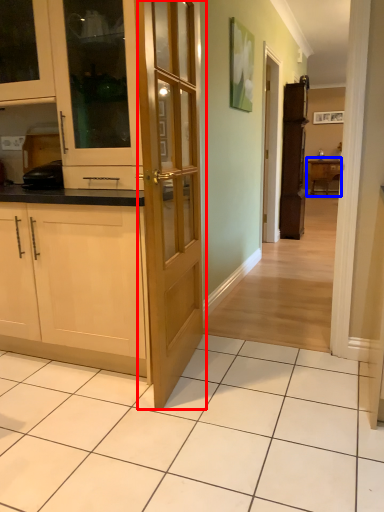
Question: Which point is closer to the camera, door (highlighted by a red box) or table (highlighted by a blue box)?

Choices:
 (A) door
 (B) table

Answer: (A)